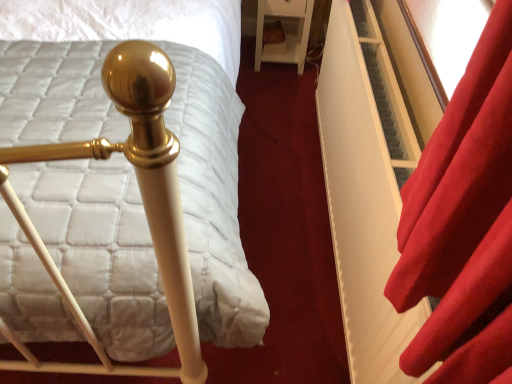
Question: From the image's perspective, is white glossy nightstand at upper right below white matte bed frame at center?

Choices:
 (A) yes
 (B) no

Answer: (B)

Question: Does white glossy nightstand at upper right have a larger size compared to white matte bed frame at center?

Choices:
 (A) no
 (B) yes

Answer: (A)

Question: Considering the relative sizes of white glossy nightstand at upper right and white matte bed frame at center in the image provided, is white glossy nightstand at upper right thinner than white matte bed frame at center?

Choices:
 (A) yes
 (B) no

Answer: (B)

Question: From a real-world perspective, is white glossy nightstand at upper right located beneath white matte bed frame at center?

Choices:
 (A) yes
 (B) no

Answer: (A)

Question: Can we say white glossy nightstand at upper right lies outside white matte bed frame at center?

Choices:
 (A) yes
 (B) no

Answer: (A)

Question: Is velvet red curtain at right in front of or behind white matte bed frame at center in the image?

Choices:
 (A) front
 (B) behind

Answer: (A)

Question: In the image, is velvet red curtain at right on the left side or the right side of white matte bed frame at center?

Choices:
 (A) left
 (B) right

Answer: (B)

Question: Is velvet red curtain at right inside or outside of white matte bed frame at center?

Choices:
 (A) outside
 (B) inside

Answer: (A)

Question: From a real-world perspective, is velvet red curtain at right positioned above or below white matte bed frame at center?

Choices:
 (A) below
 (B) above

Answer: (B)

Question: Is white matte bed frame at center in front of or behind white quilted mattress at center in the image?

Choices:
 (A) behind
 (B) front

Answer: (A)

Question: Is white matte bed frame at center spatially inside white quilted mattress at center, or outside of it?

Choices:
 (A) inside
 (B) outside

Answer: (B)

Question: Does point [x=347, y=102] appear closer or farther from the camera than point [x=250, y=334]?

Choices:
 (A) farther
 (B) closer

Answer: (A)

Question: From a real-world perspective, relative to white quilted mattress at center, is white matte bed frame at center vertically above or below?

Choices:
 (A) below
 (B) above

Answer: (A)

Question: Looking at their shapes, would you say velvet red curtain at right is wider or thinner than white glossy nightstand at upper right?

Choices:
 (A) wide
 (B) thin

Answer: (B)

Question: From their relative heights in the image, would you say velvet red curtain at right is taller or shorter than white glossy nightstand at upper right?

Choices:
 (A) short
 (B) tall

Answer: (A)